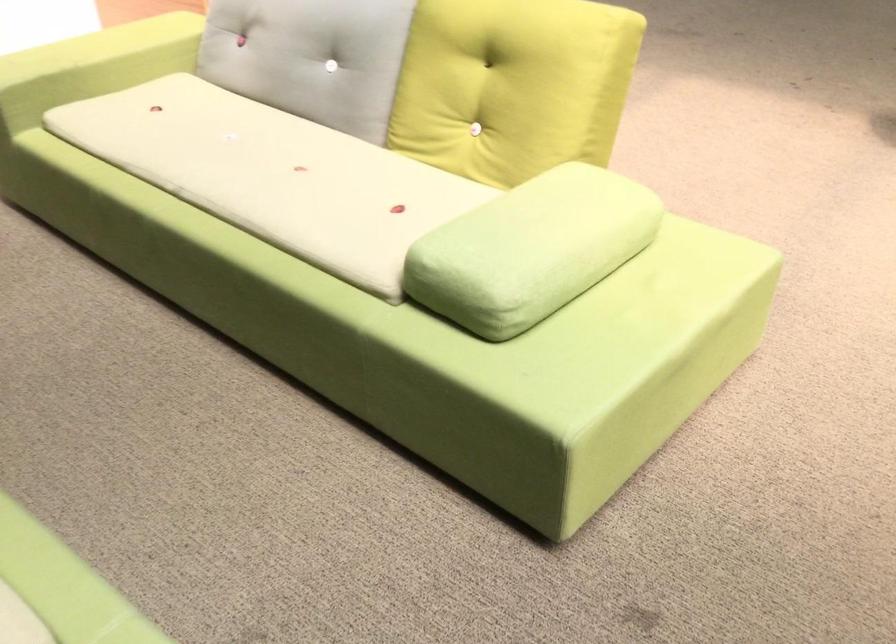
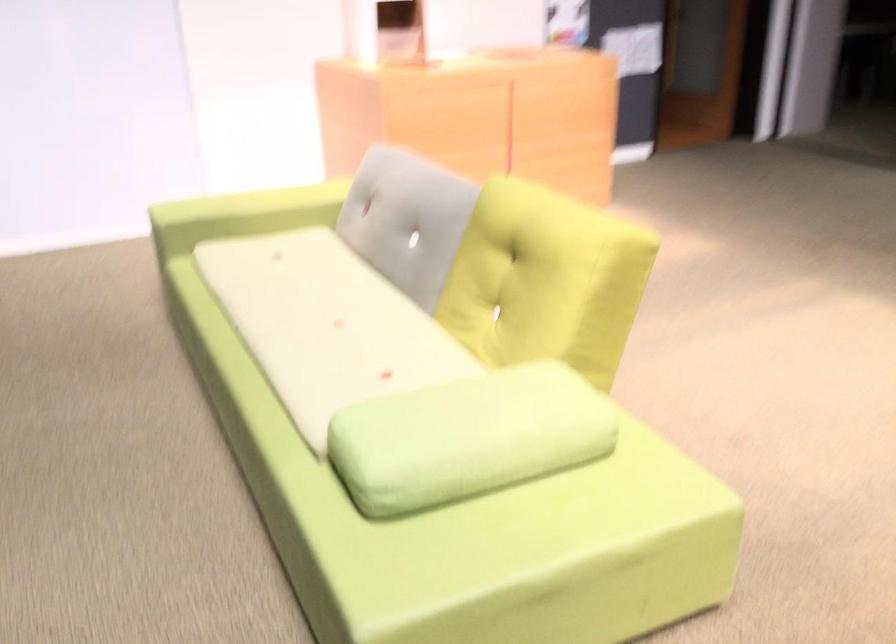
Question: The images are taken continuously from a first-person perspective. In which direction are you moving?

Choices:
 (A) Left
 (B) Right
 (C) Forward
 (D) Backward

Answer: (B)